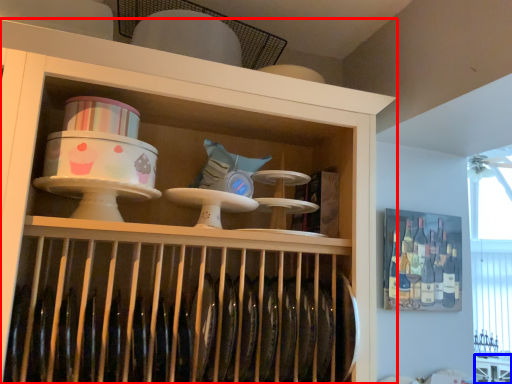
Question: Which object is closer to the camera taking this photo, shelf (highlighted by a red box) or table (highlighted by a blue box)?

Choices:
 (A) shelf
 (B) table

Answer: (A)